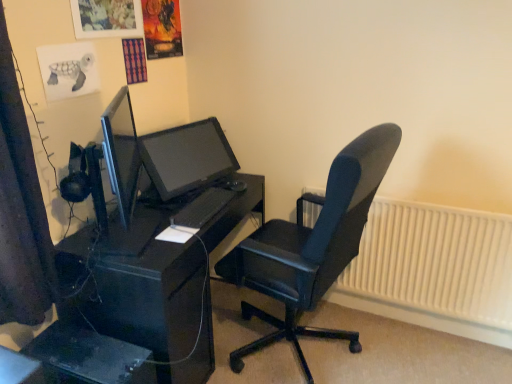
Identify the location of free area below black matte keyboard at center (from a real-world perspective). (199, 205).